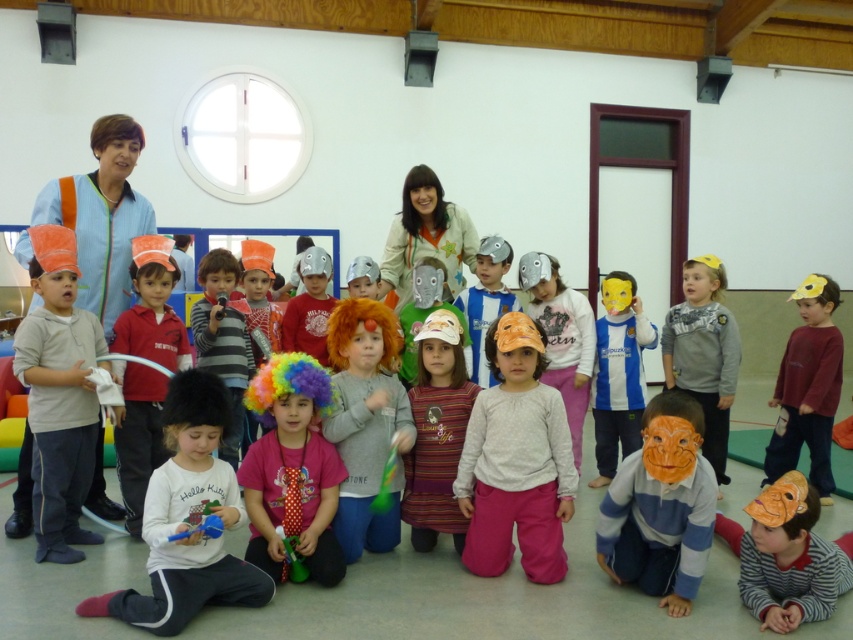
Question: Which point is closer to the camera taking this photo?

Choices:
 (A) (712, 323)
 (B) (521, 330)

Answer: (B)

Question: Is the position of white fleece sweater at center less distant than that of white fluffy hat at lower center?

Choices:
 (A) yes
 (B) no

Answer: (B)

Question: Can you confirm if white fleece sweater at center is bigger than matte gray sweater at center?

Choices:
 (A) no
 (B) yes

Answer: (A)

Question: Estimate the real-world distances between objects in this image. Which object is closer to the orange paper mask at lower center?

Choices:
 (A) matte orange hat at left
 (B) matte yellow paper hat at center

Answer: (B)

Question: Estimate the real-world distances between objects in this image. Which object is farther from the matte yellow paper hat at center?

Choices:
 (A) fluffy orange wig at center
 (B) matte gray sweater at center
 (C) striped fabric dress at center

Answer: (A)

Question: Does white fleece sweater at center appear on the right side of striped fabric dress at center?

Choices:
 (A) yes
 (B) no

Answer: (A)